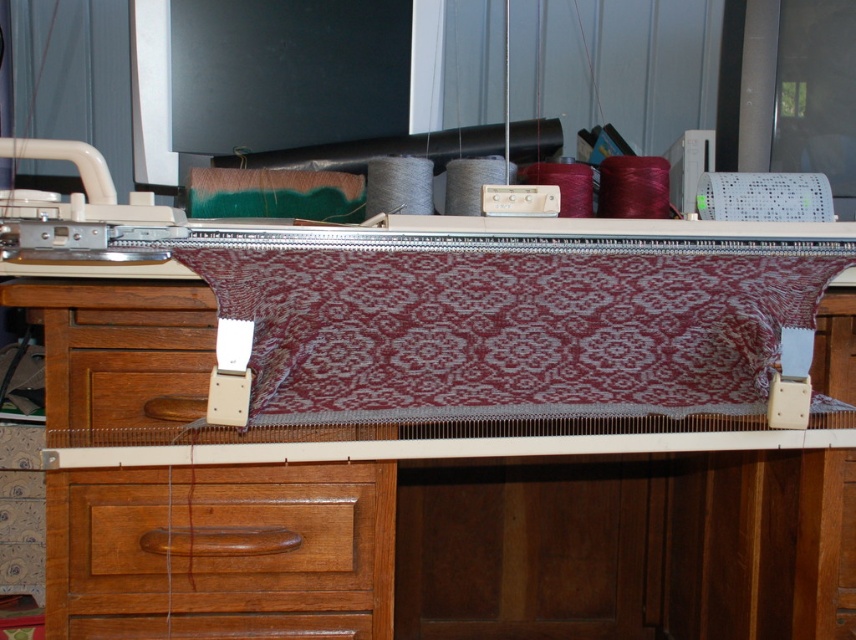
From the picture: You are organizing a craft fair and need to display both the maroon fabric at center and the wooden drawer at lower left. If you want to arrange them vertically so that the taller item is placed higher up for visibility, which one should be placed higher?

The wooden drawer at lower left should be placed higher because it is taller than the maroon fabric at center.

You need to place a large box on the wooden table at center and the wooden drawer at lower left. Based on their sizes, which object can accommodate the box?

The wooden table at center is bigger than the wooden drawer at lower left, so the wooden table at center can accommodate the box.